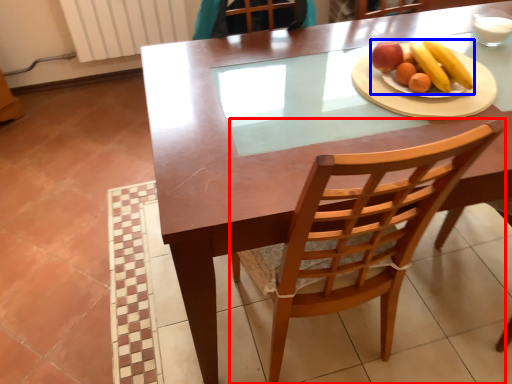
Question: Which of the following is the farthest to the observer, chair (highlighted by a red box) or fruit dish (highlighted by a blue box)?

Choices:
 (A) chair
 (B) fruit dish

Answer: (B)